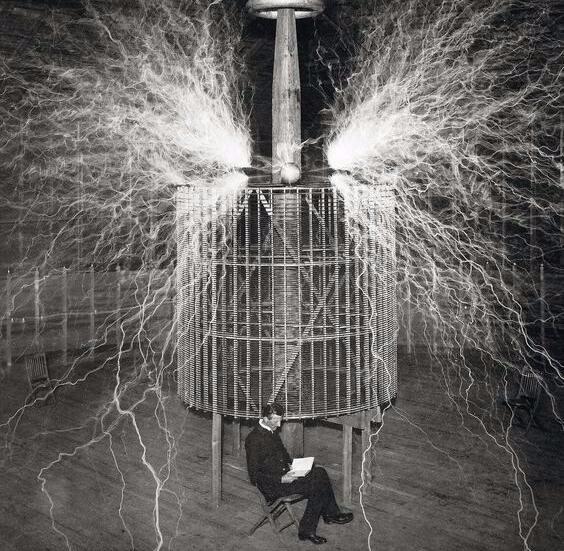
Image resolution: width=564 pixels, height=551 pixels. Identify the location of cover. (272, 6).